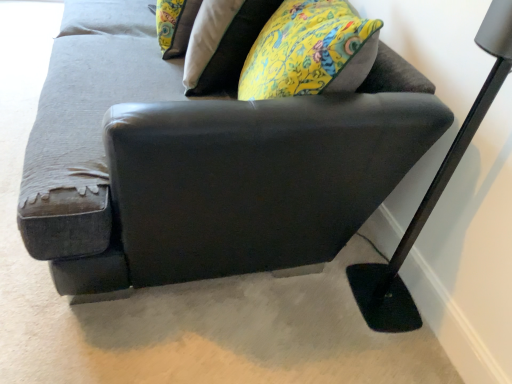
Question: Can you confirm if floral fabric pillow at upper center is taller than black metal floor lamp at lower right?

Choices:
 (A) no
 (B) yes

Answer: (A)

Question: Is floral fabric pillow at upper center not within black metal floor lamp at lower right?

Choices:
 (A) no
 (B) yes

Answer: (B)

Question: Does floral fabric pillow at upper center have a greater width compared to black metal floor lamp at lower right?

Choices:
 (A) yes
 (B) no

Answer: (A)

Question: Does floral fabric pillow at upper center have a larger size compared to black metal floor lamp at lower right?

Choices:
 (A) no
 (B) yes

Answer: (A)

Question: Does floral fabric pillow at upper center have a lesser height compared to black metal floor lamp at lower right?

Choices:
 (A) yes
 (B) no

Answer: (A)

Question: From a real-world perspective, is floral fabric pillow at upper center located beneath black metal floor lamp at lower right?

Choices:
 (A) no
 (B) yes

Answer: (A)

Question: Is black metal floor lamp at lower right further to camera compared to floral fabric pillow at upper center?

Choices:
 (A) yes
 (B) no

Answer: (B)

Question: Is black metal floor lamp at lower right thinner than floral fabric pillow at upper center?

Choices:
 (A) yes
 (B) no

Answer: (A)

Question: Is black metal floor lamp at lower right directly adjacent to floral fabric pillow at upper center?

Choices:
 (A) yes
 (B) no

Answer: (B)

Question: Could you tell me if black metal floor lamp at lower right is turned towards floral fabric pillow at upper center?

Choices:
 (A) no
 (B) yes

Answer: (A)

Question: Is black metal floor lamp at lower right surrounding floral fabric pillow at upper center?

Choices:
 (A) no
 (B) yes

Answer: (A)

Question: From the image's perspective, is black metal floor lamp at lower right under floral fabric pillow at upper center?

Choices:
 (A) yes
 (B) no

Answer: (A)

Question: Is dark gray fabric couch at center completely or partially outside of black metal floor lamp at lower right?

Choices:
 (A) yes
 (B) no

Answer: (A)